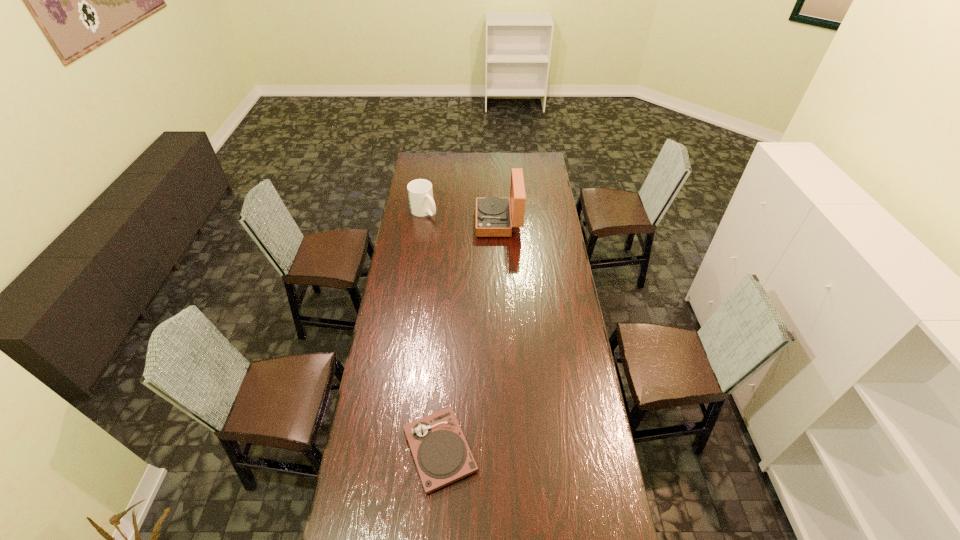
Locate an element on the screen. mug situated at the left edge is located at coordinates (420, 193).

Where is `phonograph_record at the left edge`? phonograph_record at the left edge is located at coordinates (441, 453).

I want to click on vacant space at the far edge, so click(x=449, y=167).

In order to click on vacant region at the left edge in this screenshot , I will do `click(396, 445)`.

Image resolution: width=960 pixels, height=540 pixels. I want to click on free spot at the right edge of the desktop, so click(605, 467).

Find the location of a particular element. vacant area that lies between the farther phonograph_record and the mug is located at coordinates (461, 217).

Where is `blank region between the nearest object and the taller phonograph_record`? The image size is (960, 540). blank region between the nearest object and the taller phonograph_record is located at coordinates (469, 336).

The height and width of the screenshot is (540, 960). What are the coordinates of `vacant area between the shorter phonograph_record and the second shortest object` in the screenshot? It's located at (432, 331).

Where is `vacant area that lies between the taller phonograph_record and the shorter phonograph_record`? vacant area that lies between the taller phonograph_record and the shorter phonograph_record is located at coordinates (469, 336).

The image size is (960, 540). In order to click on unoccupied area between the second tallest object and the shorter phonograph_record in this screenshot , I will do `click(432, 331)`.